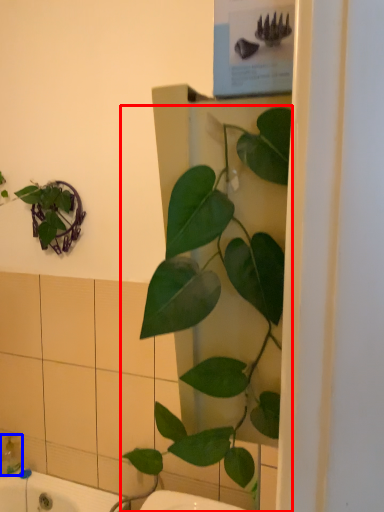
Question: Which object appears farthest to the camera in this image, houseplant (highlighted by a red box) or soap dispenser (highlighted by a blue box)?

Choices:
 (A) houseplant
 (B) soap dispenser

Answer: (B)